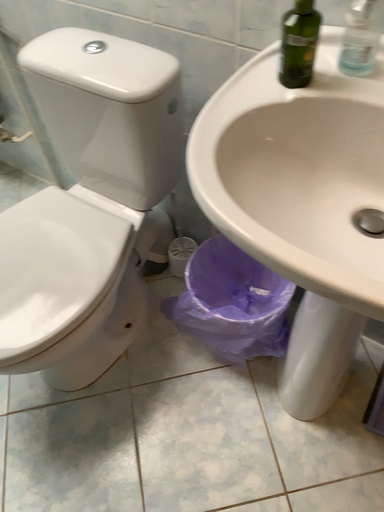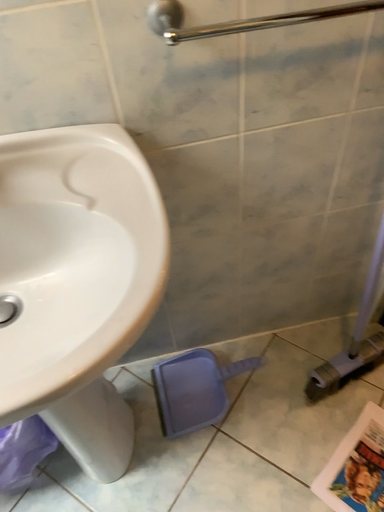
Question: How did the camera likely rotate when shooting the video?

Choices:
 (A) rotated left
 (B) rotated right

Answer: (B)